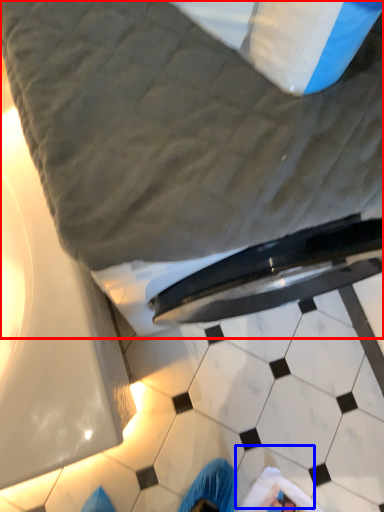
Question: Which point is further to the camera, bed (highlighted by a red box) or tile (highlighted by a blue box)?

Choices:
 (A) bed
 (B) tile

Answer: (B)